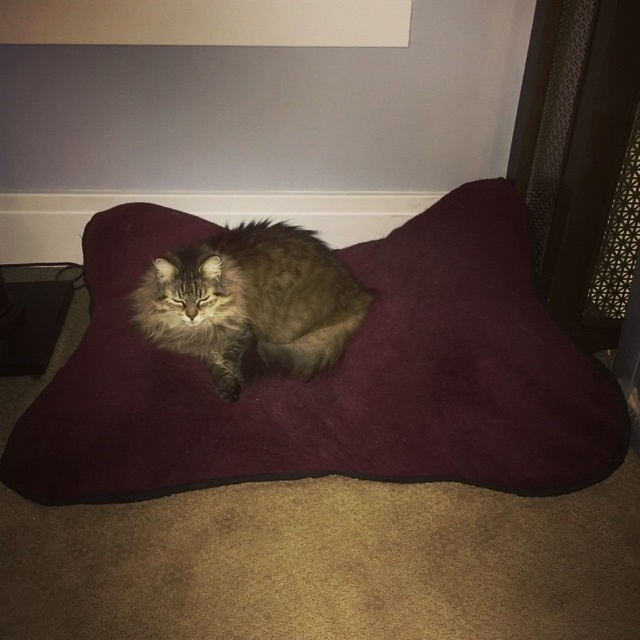
Based on the photo, you are a cat owner who wants to ensure your fuzzy brown cat at center has enough space to stretch out comfortably on the burgundy suede cat bed at center. Based on the image, can you determine if the cat will have enough vertical space on the bed?

The burgundy suede cat bed at center is much taller than the fuzzy brown cat at center, so there is sufficient vertical space for the cat to stretch out comfortably.

You are a cat owner who wants to move your fuzzy brown cat at center to the left side of the room. Which direction should you move the burgundy suede cat bed at center to make space?

To move the fuzzy brown cat at center to the left side of the room, you should move the burgundy suede cat bed at center to the right since the cat bed is currently to the right of the cat. This will create space on the left for the cat to move into.